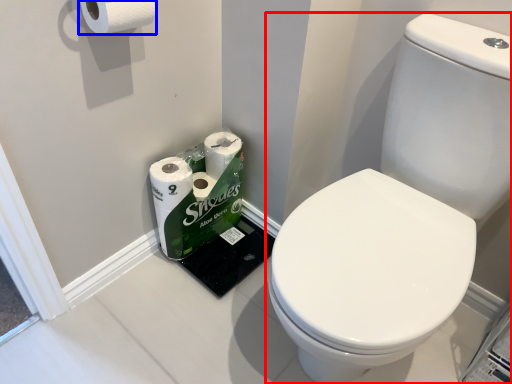
Question: Which object is closer to the camera taking this photo, toilet (highlighted by a red box) or toilet paper (highlighted by a blue box)?

Choices:
 (A) toilet
 (B) toilet paper

Answer: (A)